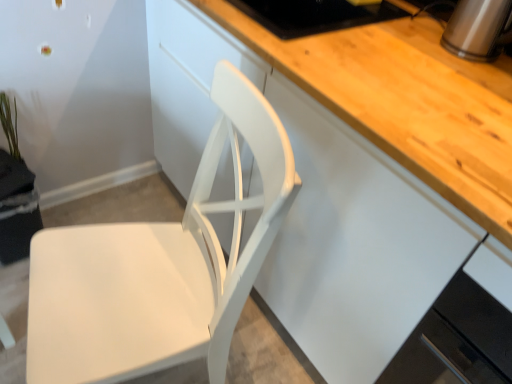
This screenshot has width=512, height=384. Find the location of `vacant area that is in front of satin silver kettle at upper right`. vacant area that is in front of satin silver kettle at upper right is located at coordinates (463, 77).